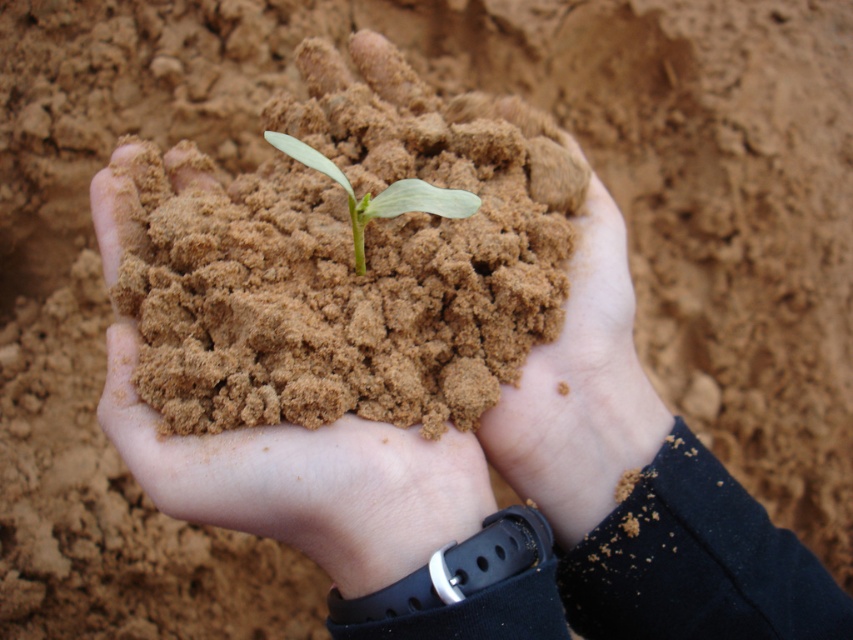
Does brown sandy soil at center have a lesser width compared to green matte plant at center?

No.

Is brown sandy soil at center to the left of green matte plant at center from the viewer's perspective?

Correct, you'll find brown sandy soil at center to the left of green matte plant at center.

Image resolution: width=853 pixels, height=640 pixels. Describe the element at coordinates (350, 256) in the screenshot. I see `brown sandy soil at center` at that location.

Find the location of `brown sandy soil at center`. brown sandy soil at center is located at coordinates (350, 256).